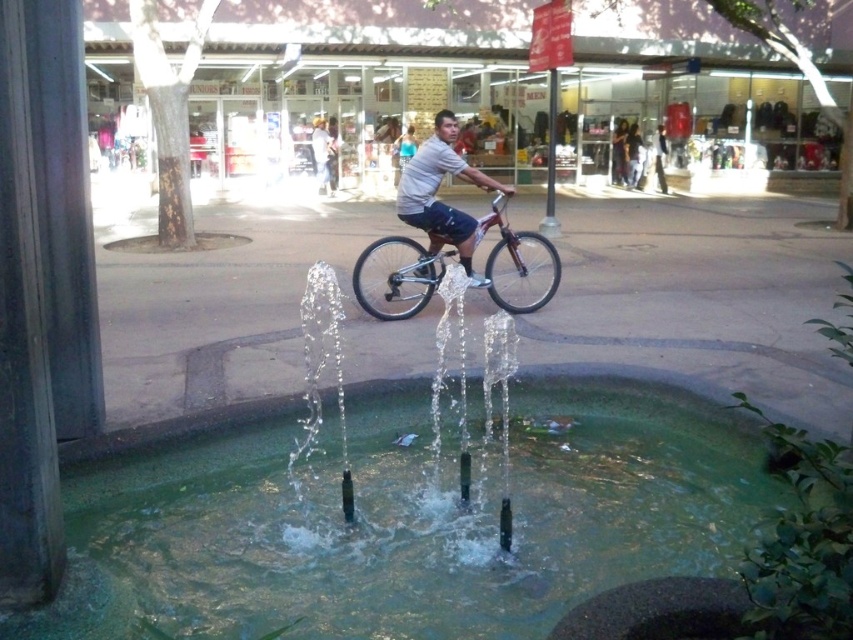
Question: Is shiny metallic bicycle at center positioned behind white matte shirt at center?

Choices:
 (A) no
 (B) yes

Answer: (B)

Question: Is clear water at center further to camera compared to shiny metallic bicycle at center?

Choices:
 (A) yes
 (B) no

Answer: (B)

Question: Which point is closer to the camera?

Choices:
 (A) white matte shirt at center
 (B) clear water at center

Answer: (B)

Question: Which object is farther from the camera taking this photo?

Choices:
 (A) shiny metallic bicycle at center
 (B) white matte shirt at center
 (C) clear water at center

Answer: (A)

Question: Is shiny metallic bicycle at center wider than white matte shirt at center?

Choices:
 (A) no
 (B) yes

Answer: (B)

Question: Which of the following is the closest to the observer?

Choices:
 (A) shiny metallic bicycle at center
 (B) white matte shirt at center

Answer: (B)